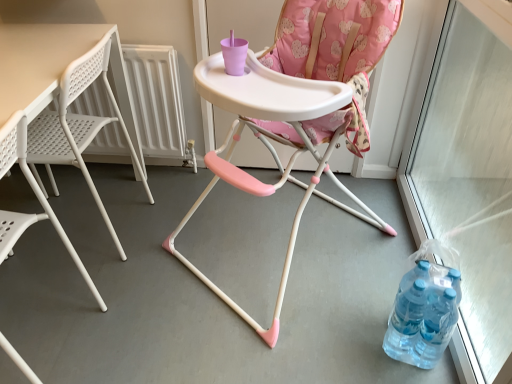
You are a GUI agent. You are given a task and a screenshot of the screen. Output one action in this format:
    pyautogui.click(x=<x>, y=<y>)
    Task: Click on the free location in front of white plastic table at left
    Image resolution: width=512 pixels, height=384 pixels.
    Given the screenshot: What is the action you would take?
    pyautogui.click(x=86, y=290)